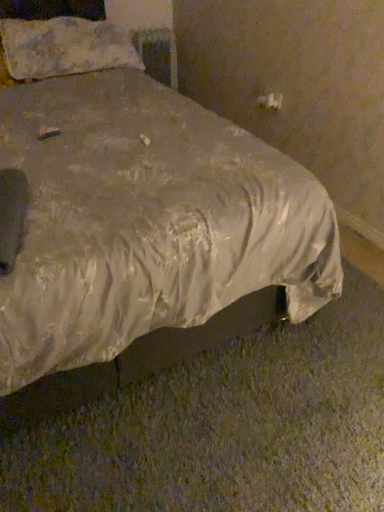
Locate an element on the screen. The height and width of the screenshot is (512, 384). fluffy white pillow at upper left is located at coordinates (64, 47).

What do you see at coordinates (158, 54) in the screenshot?
I see `metallic silver radiator at upper center` at bounding box center [158, 54].

You are a GUI agent. You are given a task and a screenshot of the screen. Output one action in this format:
    pyautogui.click(x=<x>, y=<y>)
    Task: Click on the silvery satin bed at center
    This screenshot has height=512, width=384.
    Given the screenshot: What is the action you would take?
    pyautogui.click(x=139, y=206)

Where is `fluffy white pillow at upper left`? The image size is (384, 512). fluffy white pillow at upper left is located at coordinates (64, 47).

Can you confirm if silvery satin bed at center is shorter than fluffy white pillow at upper left?

In fact, silvery satin bed at center may be taller than fluffy white pillow at upper left.

Is silvery satin bed at center not within fluffy white pillow at upper left?

Yes, silvery satin bed at center is outside of fluffy white pillow at upper left.

Considering the positions of objects silvery satin bed at center and fluffy white pillow at upper left in the image provided, who is more to the left, silvery satin bed at center or fluffy white pillow at upper left?

fluffy white pillow at upper left is more to the left.

From the image's perspective, does silvery satin bed at center appear higher than fluffy white pillow at upper left?

No, from the image's perspective, silvery satin bed at center is not on top of fluffy white pillow at upper left.

How many degrees apart are the facing directions of fluffy white pillow at upper left and silvery satin bed at center?

The angle between the facing direction of fluffy white pillow at upper left and the facing direction of silvery satin bed at center is 0.418 degrees.

From a real-world perspective, is fluffy white pillow at upper left physically located above or below silvery satin bed at center?

fluffy white pillow at upper left is situated higher than silvery satin bed at center in the real world.

From the image's perspective, is fluffy white pillow at upper left below silvery satin bed at center?

No, from the image's perspective, fluffy white pillow at upper left is not below silvery satin bed at center.

Is fluffy white pillow at upper left looking in the opposite direction of silvery satin bed at center?

Yes, fluffy white pillow at upper left is facing away from silvery satin bed at center.

Consider the image. Considering the relative sizes of metallic silver radiator at upper center and silvery satin bed at center in the image provided, is metallic silver radiator at upper center smaller than silvery satin bed at center?

Yes.

Is silvery satin bed at center surrounded by metallic silver radiator at upper center?

No, silvery satin bed at center is not a part of metallic silver radiator at upper center.

Is metallic silver radiator at upper center far away from silvery satin bed at center?

Yes.

Is metallic silver radiator at upper center in front of silvery satin bed at center?

No, it is not.

Between silvery satin bed at center and metallic silver radiator at upper center, which one has less height?

metallic silver radiator at upper center.

In the scene shown: Considering the sizes of silvery satin bed at center and metallic silver radiator at upper center in the image, is silvery satin bed at center bigger or smaller than metallic silver radiator at upper center?

silvery satin bed at center is bigger than metallic silver radiator at upper center.

Is fluffy white pillow at upper left positioned with its back to metallic silver radiator at upper center?

No, fluffy white pillow at upper left's orientation is not away from metallic silver radiator at upper center.

From the image's perspective, is fluffy white pillow at upper left located above or below metallic silver radiator at upper center?

fluffy white pillow at upper left is situated lower than metallic silver radiator at upper center in the image.

Identify the location of radiator on the right of the fluffy white pillow at upper left. (158, 54).

Between fluffy white pillow at upper left and metallic silver radiator at upper center, which one appears on the right side from the viewer's perspective?

metallic silver radiator at upper center is more to the right.

Image resolution: width=384 pixels, height=512 pixels. I want to click on radiator to the right of fluffy white pillow at upper left, so click(x=158, y=54).

Who is smaller, metallic silver radiator at upper center or fluffy white pillow at upper left?

metallic silver radiator at upper center is smaller.

From the image's perspective, between metallic silver radiator at upper center and fluffy white pillow at upper left, which one is located above?

metallic silver radiator at upper center.

Which is closer, (x=166, y=47) or (x=107, y=61)?

Point (x=166, y=47) appears to be farther away from the viewer than point (x=107, y=61).

This screenshot has height=512, width=384. What are the coordinates of `pillow lying above the silvery satin bed at center (from the image's perspective)` in the screenshot? It's located at pos(64,47).

What are the coordinates of `pillow that is on the left side of silvery satin bed at center` in the screenshot? It's located at (64, 47).

In the scene shown: Looking at the image, which one is located further to silvery satin bed at center, fluffy white pillow at upper left or metallic silver radiator at upper center?

metallic silver radiator at upper center is positioned further to the anchor silvery satin bed at center.

Considering their positions, is fluffy white pillow at upper left positioned closer to metallic silver radiator at upper center than silvery satin bed at center?

Among the two, fluffy white pillow at upper left is located nearer to metallic silver radiator at upper center.

Consider the image. Looking at the image, which one is located closer to metallic silver radiator at upper center, silvery satin bed at center or fluffy white pillow at upper left?

→ fluffy white pillow at upper left is positioned closer to the anchor metallic silver radiator at upper center.

Based on the photo, from the image, which object appears to be farther from fluffy white pillow at upper left, metallic silver radiator at upper center or silvery satin bed at center?

metallic silver radiator at upper center.

Based on their spatial positions, is silvery satin bed at center or metallic silver radiator at upper center closer to fluffy white pillow at upper left?

silvery satin bed at center lies closer to fluffy white pillow at upper left than the other object.

Looking at the image, which one is located closer to silvery satin bed at center, metallic silver radiator at upper center or fluffy white pillow at upper left?

Among the two, fluffy white pillow at upper left is located nearer to silvery satin bed at center.

Locate an element on the screen. pillow between silvery satin bed at center and metallic silver radiator at upper center along the z-axis is located at coordinates point(64,47).